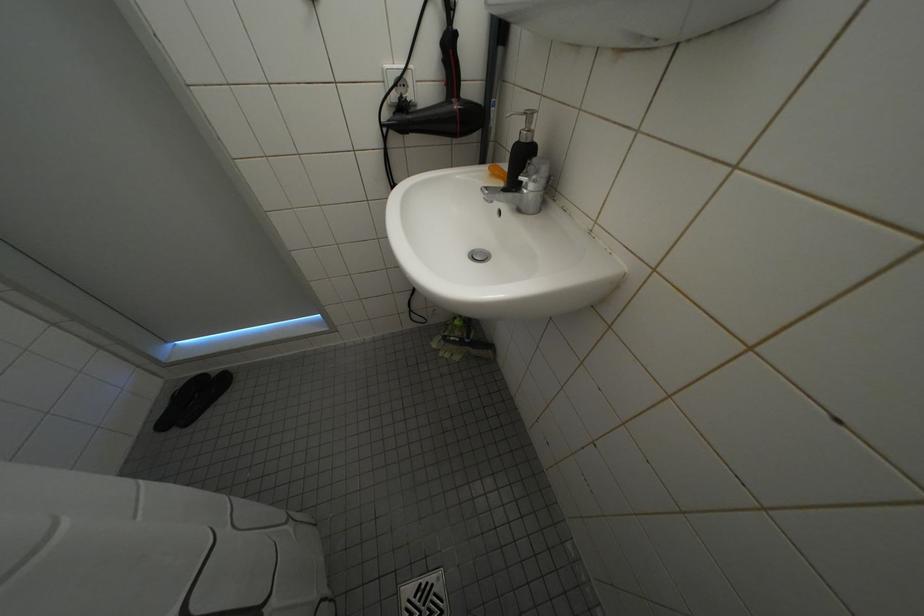
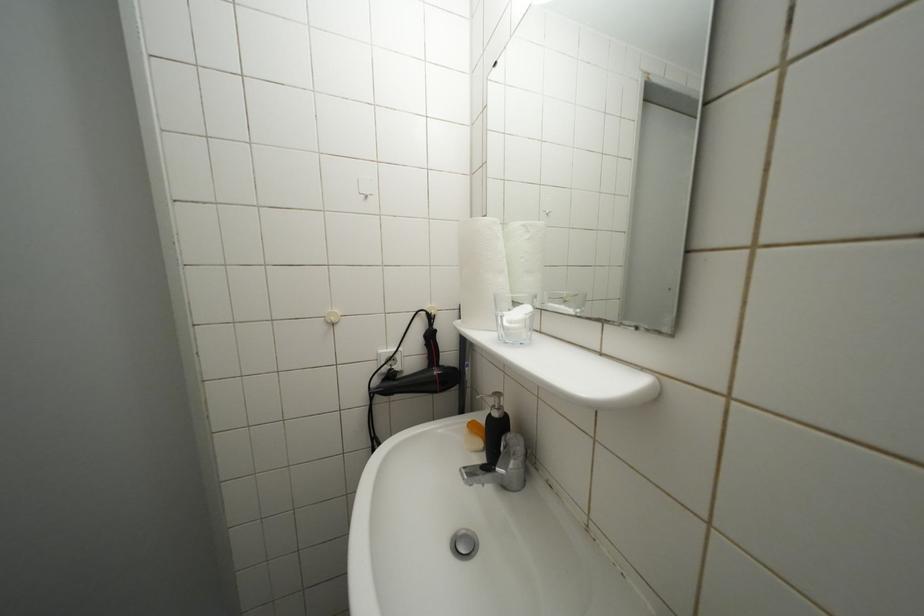
Question: The images are taken continuously from a first-person perspective. In which direction is your viewpoint rotating?

Choices:
 (A) Left
 (B) Right
 (C) Up
 (D) Down

Answer: (C)